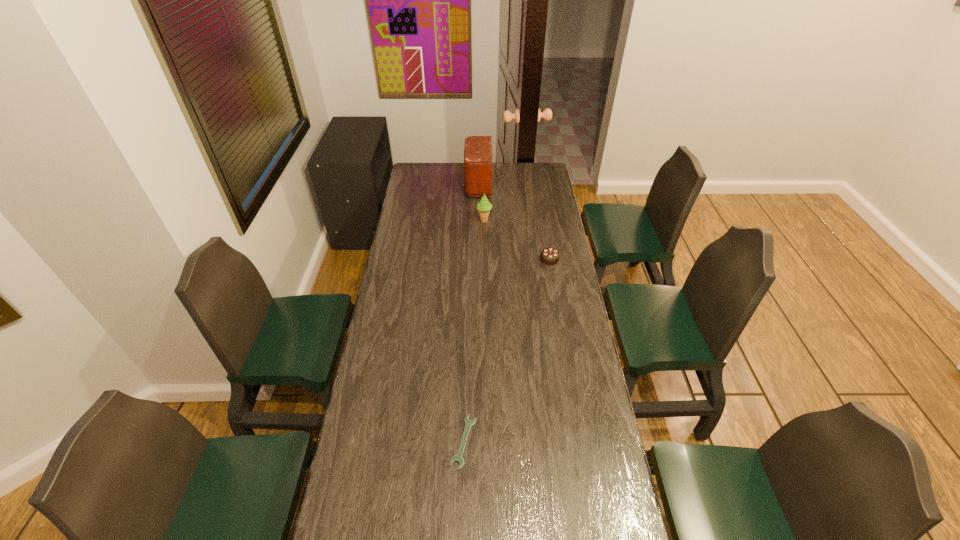
Locate an element on the screen. This screenshot has width=960, height=540. the farthest object is located at coordinates (478, 162).

You are a GUI agent. You are given a task and a screenshot of the screen. Output one action in this format:
    pyautogui.click(x=<x>, y=<y>)
    Task: Click on the radio receiver
    
    Given the screenshot: What is the action you would take?
    pyautogui.click(x=478, y=162)

I want to click on the third shortest object, so click(x=484, y=206).

At what (x,y) coordinates should I click in order to perform the action: click on icecream. Please return your answer as a coordinate pair (x, y). This screenshot has height=540, width=960. Looking at the image, I should click on pyautogui.click(x=484, y=206).

The height and width of the screenshot is (540, 960). I want to click on the rightmost object, so click(550, 256).

The image size is (960, 540). I want to click on the third tallest object, so click(x=550, y=256).

Find the location of a particular element. This screenshot has height=540, width=960. wrench is located at coordinates (458, 457).

Find the location of a particular element. the shortest object is located at coordinates (458, 457).

I want to click on free space located on the front panel of the farthest object, so click(420, 185).

Locate an element on the screen. This screenshot has height=540, width=960. free location located 0.050m on the front panel of the farthest object is located at coordinates (454, 185).